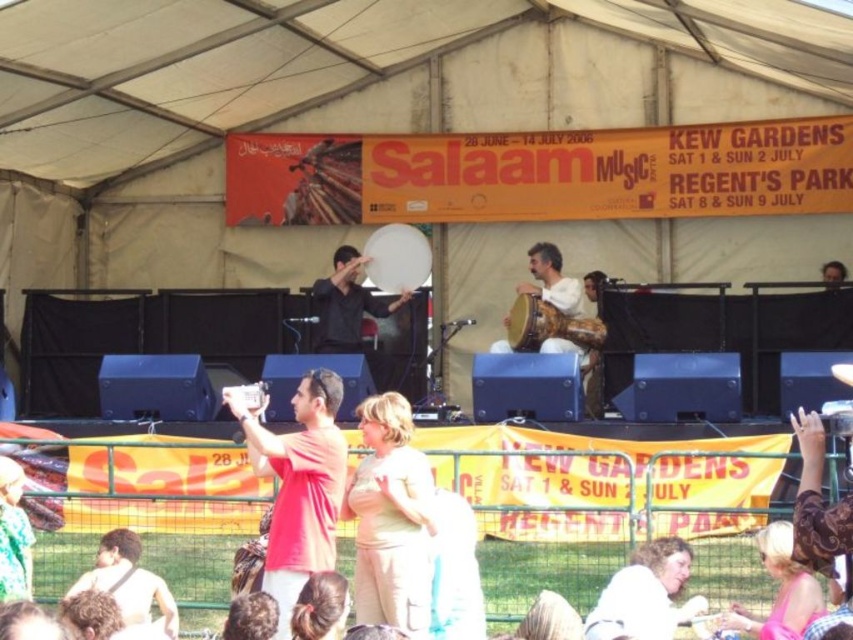
Question: Is blonde hair at lower right wider than matte black drum at center?

Choices:
 (A) yes
 (B) no

Answer: (B)

Question: Is beige cotton dress at center to the left of light brown hair at lower center from the viewer's perspective?

Choices:
 (A) yes
 (B) no

Answer: (A)

Question: Does red matte shirt at center have a lesser width compared to light brown hair at lower center?

Choices:
 (A) yes
 (B) no

Answer: (B)

Question: Which of these objects is positioned closest to the matte black drum at center?

Choices:
 (A) wooden drum at center
 (B) light brown hair at lower center
 (C) beige cotton dress at center
 (D) red matte shirt at center

Answer: (A)

Question: Based on their relative distances, which object is farther from the light brown hair at lower center?

Choices:
 (A) red matte shirt at center
 (B) matte black drum at center
 (C) shiny black shirt at lower left
 (D) wooden drum at center

Answer: (B)

Question: Which object appears closest to the camera in this image?

Choices:
 (A) blonde hair at lower right
 (B) light brown hair at lower center
 (C) beige cotton dress at center
 (D) wooden drum at center

Answer: (B)